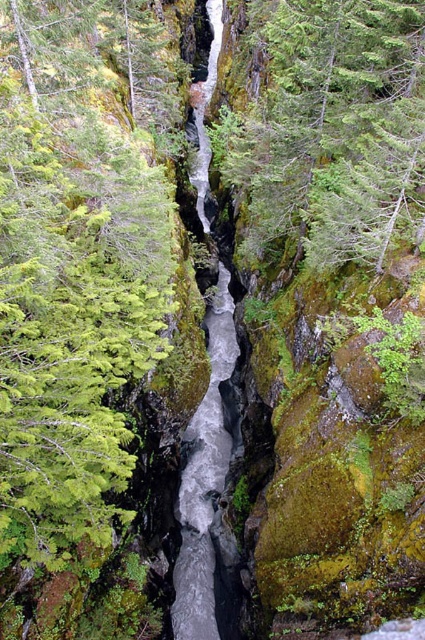
Does green needle-like foliage at left appear under green mossy tree at center?

Yes, green needle-like foliage at left is below green mossy tree at center.

Who is lower down, green needle-like foliage at left or green mossy tree at center?

Positioned lower is green needle-like foliage at left.

Looking at this image, who is more forward, [107,380] or [286,224]?

Point [107,380]

Locate an element on the screen. The width and height of the screenshot is (425, 640). green needle-like foliage at left is located at coordinates (76, 262).

Can you confirm if green mossy tree at center is positioned below gray smooth stream at center?

Indeed, green mossy tree at center is positioned under gray smooth stream at center.

Between green mossy tree at center and gray smooth stream at center, which one appears on the left side from the viewer's perspective?

gray smooth stream at center

Measure the distance between point (325, 164) and camera.

They are 70.81 feet apart.

You are a GUI agent. You are given a task and a screenshot of the screen. Output one action in this format:
    pyautogui.click(x=<x>, y=<y>)
    Task: Click on the green mossy tree at center
    The image size is (425, 640).
    Given the screenshot: What is the action you would take?
    pyautogui.click(x=334, y=129)

Is green needle-like foliage at left wider than gray smooth stream at center?

Yes, green needle-like foliage at left is wider than gray smooth stream at center.

Is green needle-like foliage at left closer to the viewer compared to gray smooth stream at center?

Yes, green needle-like foliage at left is in front of gray smooth stream at center.

Describe the element at coordinates (76, 262) in the screenshot. I see `green needle-like foliage at left` at that location.

The height and width of the screenshot is (640, 425). Identify the location of green needle-like foliage at left. (76, 262).